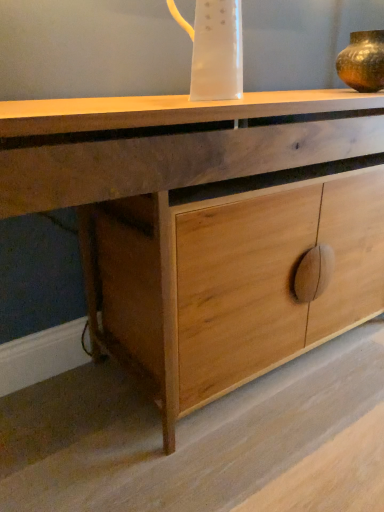
Question: Considering the positions of natural wood cabinet at center and gold metallic vase at upper right in the image, is natural wood cabinet at center taller or shorter than gold metallic vase at upper right?

Choices:
 (A) short
 (B) tall

Answer: (B)

Question: Is point (8, 201) closer or farther from the camera than point (352, 75)?

Choices:
 (A) closer
 (B) farther

Answer: (A)

Question: Which object is the closest to the natural wood cabinet at center?

Choices:
 (A) transparent plastic jug at upper center
 (B) gold metallic vase at upper right

Answer: (A)

Question: Based on their relative distances, which object is farther from the gold metallic vase at upper right?

Choices:
 (A) natural wood cabinet at center
 (B) transparent plastic jug at upper center

Answer: (A)